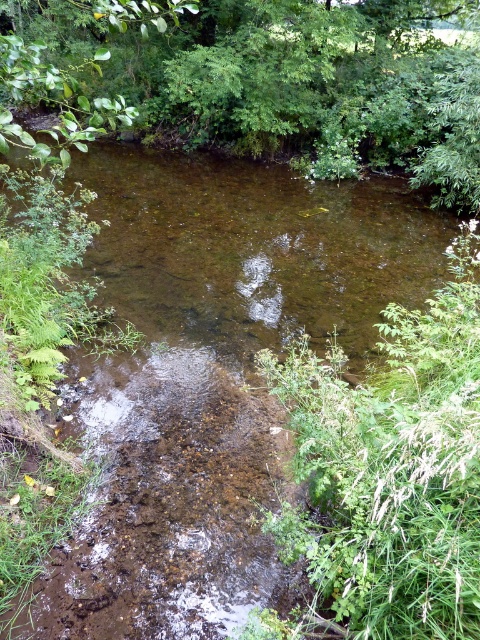
You are a hiker trying to cross the brown muddy stream at center. You notice a green leafy tree at upper center nearby. Which object is shorter in height?

The green leafy tree at upper center is shorter than the brown muddy stream at center.

You are standing at the point marked by point (x=272, y=80) in the scene. What do you see directly in front of you?

You see a green leafy tree at upper center directly in front of you.